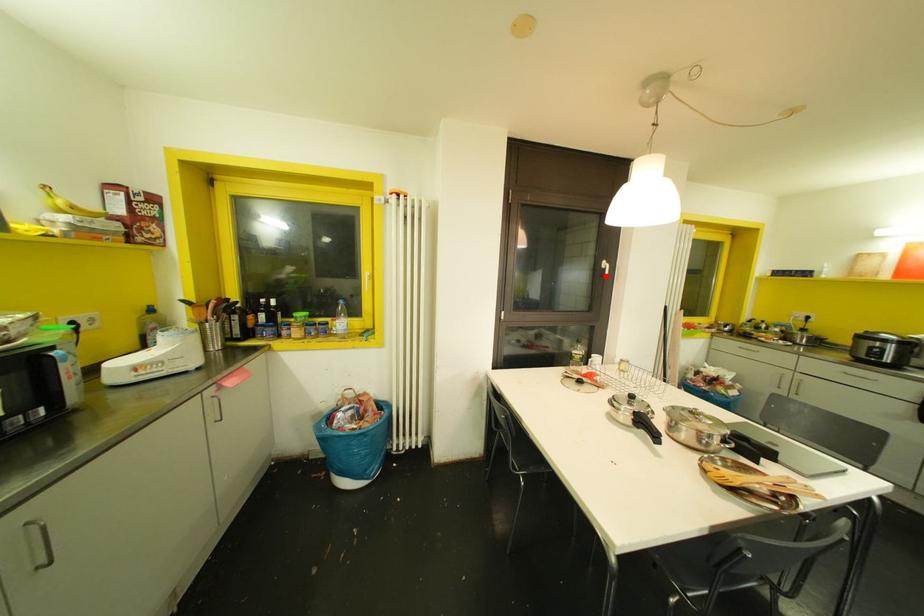
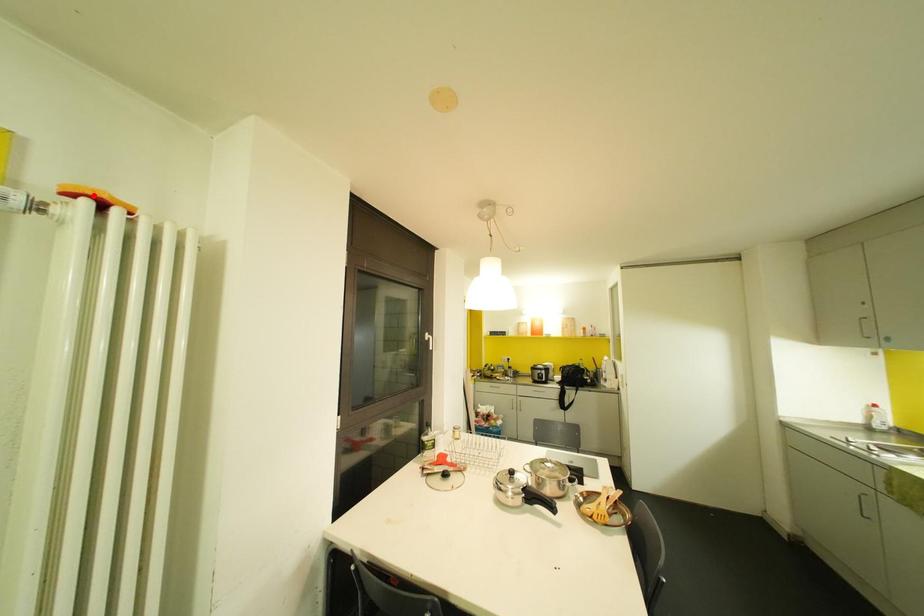
I am providing you with two images of the same scene from different viewpoints. A red point is marked on the first image and another point is marked on the second image. Are the points marked in image1 and image2 representing the same 3D position?

No